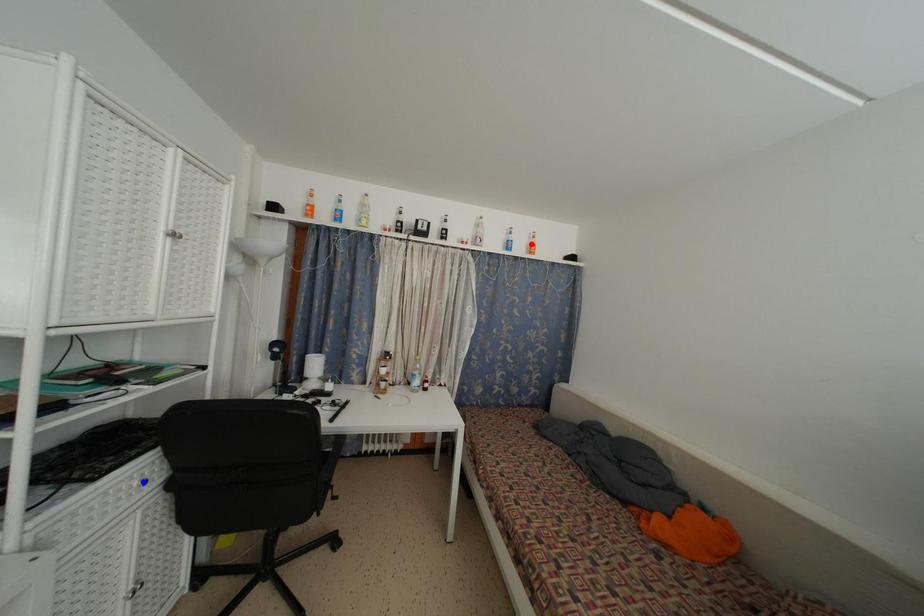
Question: In the image, two points are highlighted. Which point is nearer to the camera? Reply with the corresponding letter.

Choices:
 (A) blue point
 (B) red point

Answer: (A)